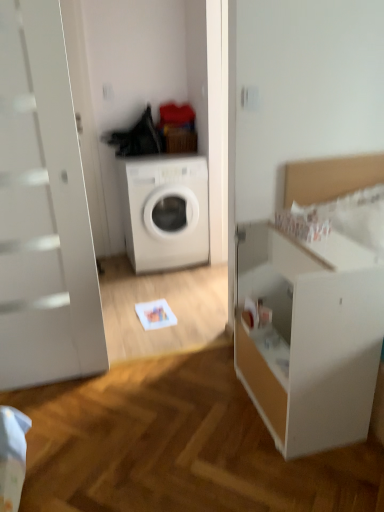
Question: Is white matte washing machine at center behind white matte dresser at right?

Choices:
 (A) no
 (B) yes

Answer: (B)

Question: From the image's perspective, would you say white matte washing machine at center is positioned over white matte dresser at right?

Choices:
 (A) yes
 (B) no

Answer: (A)

Question: Is white matte washing machine at center closer to camera compared to white matte dresser at right?

Choices:
 (A) yes
 (B) no

Answer: (B)

Question: Is white matte washing machine at center thinner than white matte dresser at right?

Choices:
 (A) yes
 (B) no

Answer: (B)

Question: From a real-world perspective, is white matte washing machine at center beneath white matte dresser at right?

Choices:
 (A) no
 (B) yes

Answer: (A)

Question: Would you say white matte dresser at right is part of white matte washing machine at center's contents?

Choices:
 (A) no
 (B) yes

Answer: (A)

Question: Is white matte dresser at right positioned behind white matte washing machine at center?

Choices:
 (A) yes
 (B) no

Answer: (B)

Question: Considering the relative sizes of white matte dresser at right and white matte washing machine at center in the image provided, is white matte dresser at right shorter than white matte washing machine at center?

Choices:
 (A) no
 (B) yes

Answer: (B)

Question: Considering the relative positions of white matte dresser at right and white matte washing machine at center in the image provided, is white matte dresser at right to the right of white matte washing machine at center from the viewer's perspective?

Choices:
 (A) no
 (B) yes

Answer: (B)

Question: Is white matte dresser at right positioned with its back to white matte washing machine at center?

Choices:
 (A) no
 (B) yes

Answer: (A)

Question: From the image's perspective, does white matte dresser at right appear lower than white matte washing machine at center?

Choices:
 (A) no
 (B) yes

Answer: (B)

Question: Does white matte dresser at right have a smaller size compared to white matte washing machine at center?

Choices:
 (A) no
 (B) yes

Answer: (B)

Question: From the image's perspective, relative to white matte dresser at right, is white matte washing machine at center above or below?

Choices:
 (A) below
 (B) above

Answer: (B)